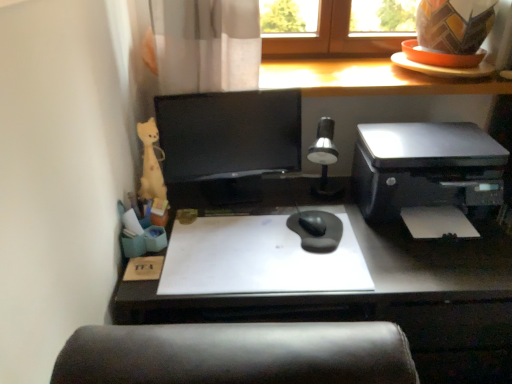
Question: Considering their positions, is silver metallic table lamp at center located in front of or behind white paper at right?

Choices:
 (A) front
 (B) behind

Answer: (B)

Question: Looking at their shapes, would you say silver metallic table lamp at center is wider or thinner than white paper at right?

Choices:
 (A) wide
 (B) thin

Answer: (B)

Question: Estimate the real-world distances between objects in this image. Which object is farther from the matte wood counter top at upper center?

Choices:
 (A) matte black desk at center
 (B) satin black printer at right
 (C) yellow plush toy at left
 (D) white paper at right
 (E) silver metallic table lamp at center

Answer: (C)

Question: Which object is the closest to the black glossy monitor at center?

Choices:
 (A) satin black printer at right
 (B) matte wood counter top at upper center
 (C) yellow plush toy at left
 (D) matte black desk at center
 (E) white paper at right

Answer: (C)